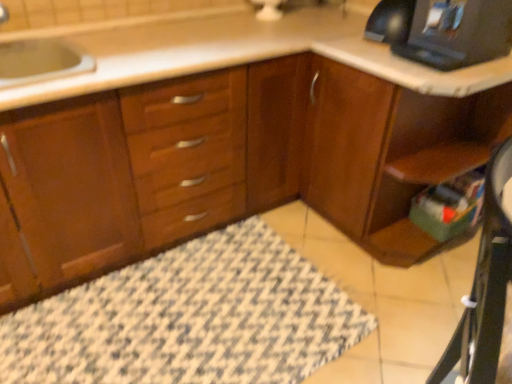
Question: Is wooden computer desk at lower right far away from wooden cabinet at center?

Choices:
 (A) yes
 (B) no

Answer: (B)

Question: Does wooden computer desk at lower right have a greater width compared to wooden cabinet at center?

Choices:
 (A) no
 (B) yes

Answer: (A)

Question: Does wooden computer desk at lower right turn towards wooden cabinet at center?

Choices:
 (A) no
 (B) yes

Answer: (A)

Question: Can we say wooden computer desk at lower right lies outside wooden cabinet at center?

Choices:
 (A) no
 (B) yes

Answer: (B)

Question: Is wooden computer desk at lower right taller than wooden cabinet at center?

Choices:
 (A) yes
 (B) no

Answer: (A)

Question: From the image's perspective, is black plastic desktop computer at upper right located above or below wooden cabinet at lower right?

Choices:
 (A) above
 (B) below

Answer: (A)

Question: Is black plastic desktop computer at upper right wider or thinner than wooden cabinet at lower right?

Choices:
 (A) wide
 (B) thin

Answer: (B)

Question: Is black plastic desktop computer at upper right bigger or smaller than wooden cabinet at lower right?

Choices:
 (A) big
 (B) small

Answer: (B)

Question: Does point (455, 9) appear closer or farther from the camera than point (397, 112)?

Choices:
 (A) closer
 (B) farther

Answer: (B)

Question: From their relative heights in the image, would you say wooden computer desk at lower right is taller or shorter than patterned fabric bath mat at lower center?

Choices:
 (A) short
 (B) tall

Answer: (B)

Question: From a real-world perspective, relative to patterned fabric bath mat at lower center, is wooden computer desk at lower right vertically above or below?

Choices:
 (A) above
 (B) below

Answer: (A)

Question: Considering the positions of point (501, 168) and point (66, 339), is point (501, 168) closer or farther from the camera than point (66, 339)?

Choices:
 (A) closer
 (B) farther

Answer: (A)

Question: In the image, is wooden computer desk at lower right positioned in front of or behind patterned fabric bath mat at lower center?

Choices:
 (A) behind
 (B) front

Answer: (B)

Question: Considering the positions of wooden cabinet at lower right and patterned fabric bath mat at lower center in the image, is wooden cabinet at lower right bigger or smaller than patterned fabric bath mat at lower center?

Choices:
 (A) big
 (B) small

Answer: (A)

Question: Considering the positions of wooden cabinet at lower right and patterned fabric bath mat at lower center in the image, is wooden cabinet at lower right wider or thinner than patterned fabric bath mat at lower center?

Choices:
 (A) wide
 (B) thin

Answer: (B)